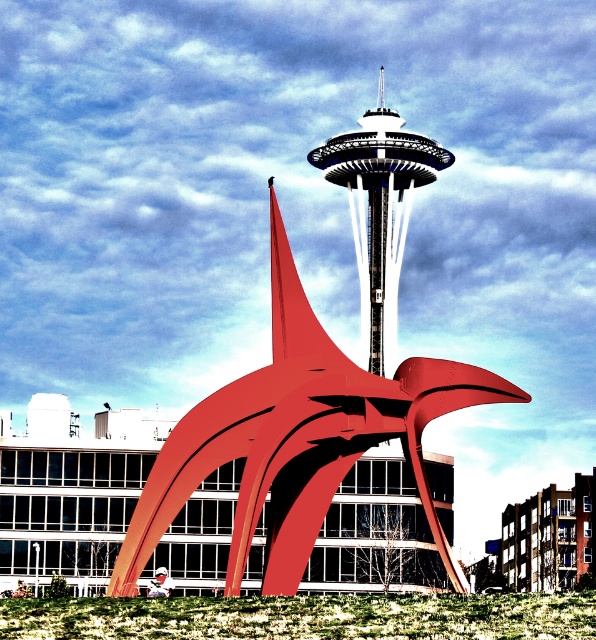
You are a photographer standing at the camera position in the scene. You want to capture a photo of the metallic red sculpture at center. The camera has a maximum focus range of 85 meters. Will the sculpture be in focus?

The metallic red sculpture at center is 87.46 meters away from camera, which exceeds the camera maximum focus range of 85 meters. Therefore, the sculpture will not be in focus.

You are a photographer standing at the edge of the green grass at lower center, aiming to capture the metallic red sculpture at center in your shot. Considering the height difference between them, will the sculpture be mostly visible in your photo?

The metallic red sculpture at center has a greater height compared to green grass at lower center, so the sculpture will be mostly visible in your photo as it towers above the grass.